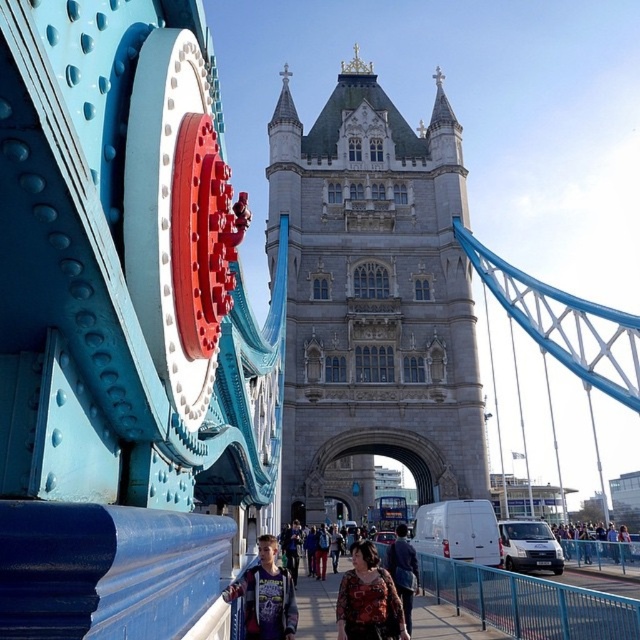
Does gray stone tower at center appear over dark blue jeans at lower right?

Indeed, gray stone tower at center is positioned over dark blue jeans at lower right.

Who is positioned more to the left, gray stone tower at center or dark blue jeans at lower right?

From the viewer's perspective, gray stone tower at center appears more on the left side.

Where is `gray stone tower at center`? The height and width of the screenshot is (640, 640). gray stone tower at center is located at coordinates (372, 296).

Can you confirm if floral-patterned blouse at center is shorter than dark blue jeans at lower right?

Incorrect, floral-patterned blouse at center's height does not fall short of dark blue jeans at lower right's.

Can you confirm if floral-patterned blouse at center is positioned to the right of dark blue jeans at lower right?

Incorrect, floral-patterned blouse at center is not on the right side of dark blue jeans at lower right.

Which is behind, point (349, 637) or point (593, 538)?

Positioned behind is point (593, 538).

Locate an element on the screen. floral-patterned blouse at center is located at coordinates (369, 600).

From the picture: Between gray stone tower at center and dark blue jacket at center, which one is positioned higher?

gray stone tower at center is higher up.

Can you confirm if gray stone tower at center is positioned to the right of dark blue jacket at center?

Indeed, gray stone tower at center is positioned on the right side of dark blue jacket at center.

Between point (314, 285) and point (228, 600), which one is positioned in front?

Point (228, 600) is in front.

Identify the location of gray stone tower at center. (372, 296).